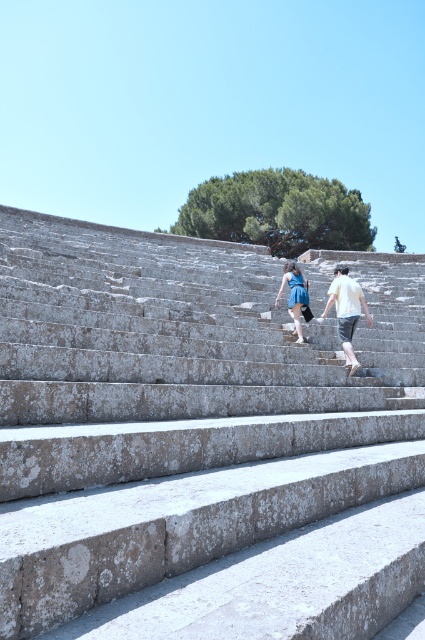
Question: Estimate the real-world distances between objects in this image. Which object is closer to the blue denim dress at center?

Choices:
 (A) gray stone steps at center
 (B) white cotton shirt at center

Answer: (B)

Question: Is gray stone steps at center to the right of blue denim dress at center from the viewer's perspective?

Choices:
 (A) yes
 (B) no

Answer: (B)

Question: Among these points, which one is nearest to the camera?

Choices:
 (A) (303, 282)
 (B) (198, 285)

Answer: (A)

Question: Is white cotton shirt at center behind blue denim dress at center?

Choices:
 (A) no
 (B) yes

Answer: (A)

Question: Which of the following is the farthest from the observer?

Choices:
 (A) gray stone steps at center
 (B) blue denim dress at center

Answer: (B)

Question: Can you confirm if white cotton shirt at center is wider than blue denim dress at center?

Choices:
 (A) no
 (B) yes

Answer: (B)